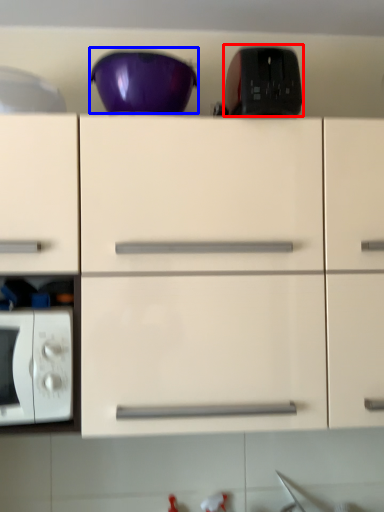
Question: Which point is further to the camera, appliance (highlighted by a red box) or bowl (highlighted by a blue box)?

Choices:
 (A) appliance
 (B) bowl

Answer: (B)